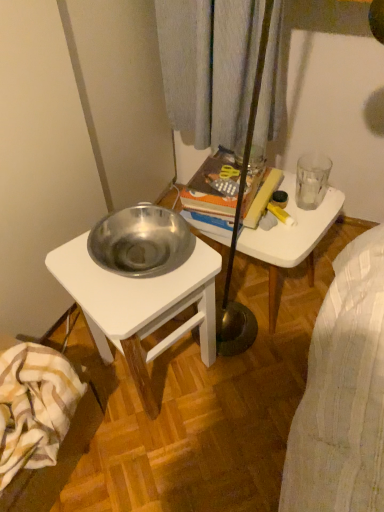
This screenshot has width=384, height=512. Identify the location of free spot to the right of striped cotton blanket at lower left. (135, 459).